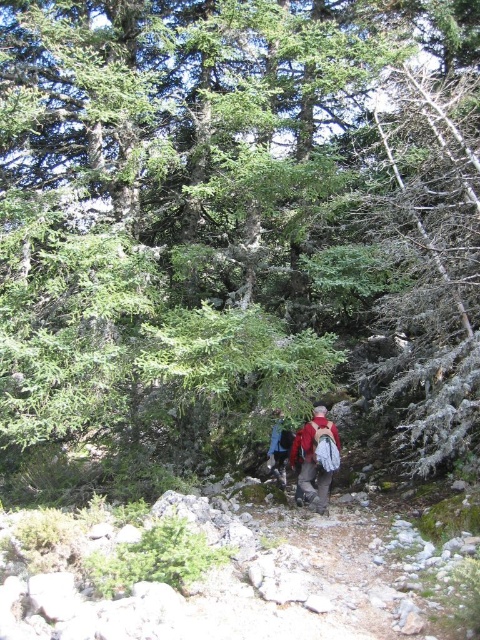
Question: Does red backpack at center have a lesser width compared to blue fabric backpack at center?

Choices:
 (A) yes
 (B) no

Answer: (B)

Question: Can you confirm if red backpack at center is thinner than blue fabric backpack at center?

Choices:
 (A) no
 (B) yes

Answer: (A)

Question: Among these points, which one is nearest to the camera?

Choices:
 (A) (280, 444)
 (B) (309, 429)

Answer: (B)

Question: Is red backpack at center below blue fabric backpack at center?

Choices:
 (A) no
 (B) yes

Answer: (B)